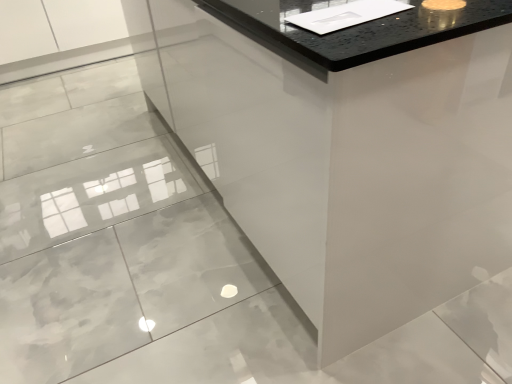
Question: Should I look upward or downward to see white glossy vanity at center?

Choices:
 (A) down
 (B) up

Answer: (B)